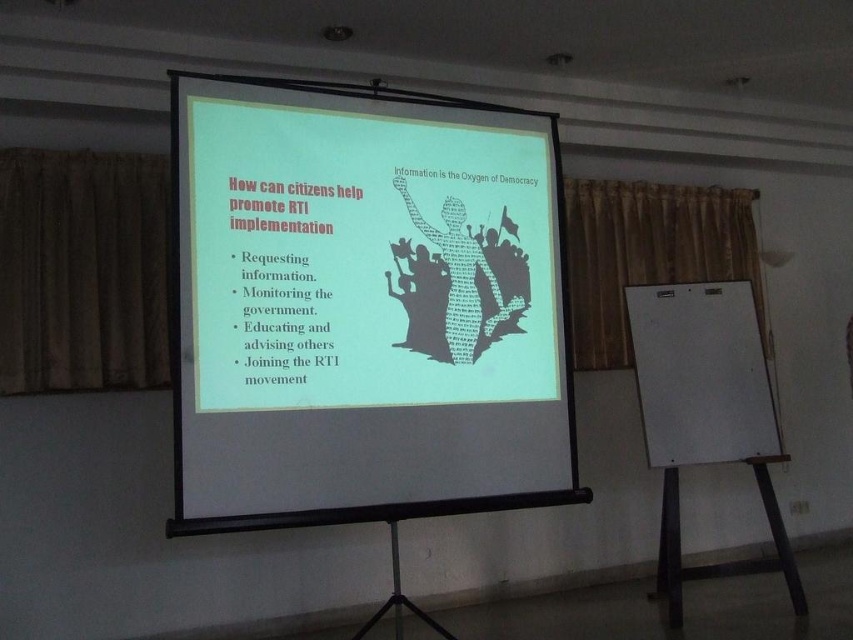
Which of these two, white matte projection screen at center or white matte easel at right, stands shorter?

With less height is white matte easel at right.

Can you confirm if white matte projection screen at center is positioned to the left of white matte easel at right?

Indeed, white matte projection screen at center is positioned on the left side of white matte easel at right.

Identify the location of white matte projection screen at center. The image size is (853, 640). (363, 307).